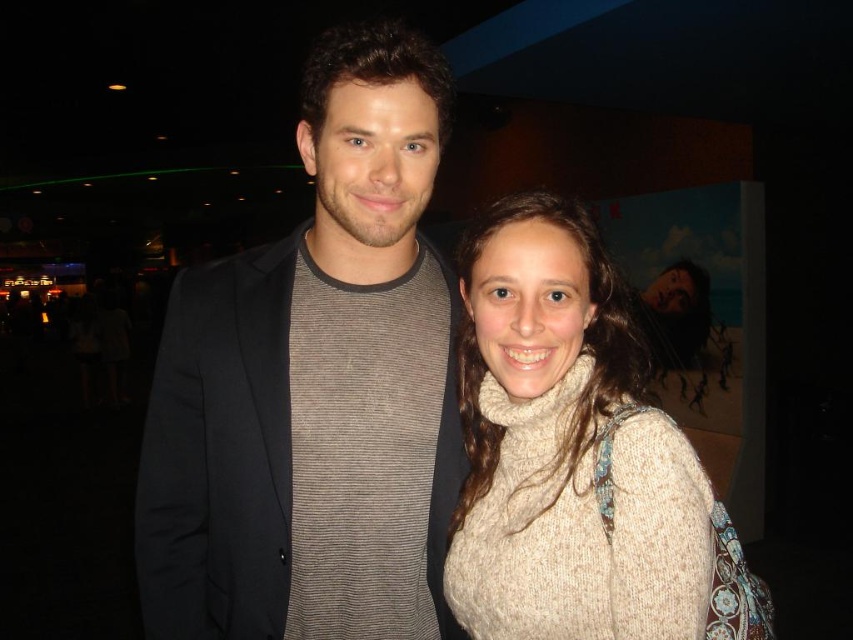
Question: Which of the following is the closest to the observer?

Choices:
 (A) dark gray knit sweater at center
 (B) white knitted sweater at center

Answer: (B)

Question: Is dark gray knit sweater at center wider than white knitted sweater at center?

Choices:
 (A) yes
 (B) no

Answer: (A)

Question: Is dark gray knit sweater at center positioned in front of white knitted sweater at center?

Choices:
 (A) yes
 (B) no

Answer: (B)

Question: Can you confirm if dark gray knit sweater at center is bigger than white knitted sweater at center?

Choices:
 (A) yes
 (B) no

Answer: (A)